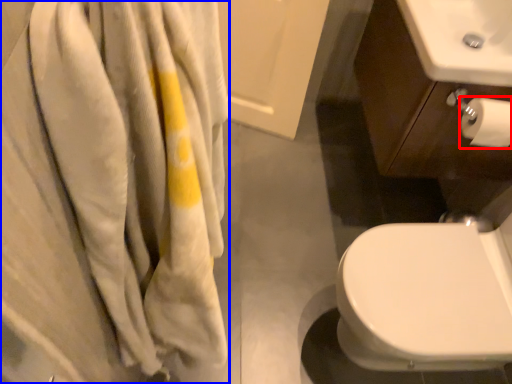
Question: Which object is further to the camera taking this photo, toilet paper (highlighted by a red box) or bath towel (highlighted by a blue box)?

Choices:
 (A) toilet paper
 (B) bath towel

Answer: (A)